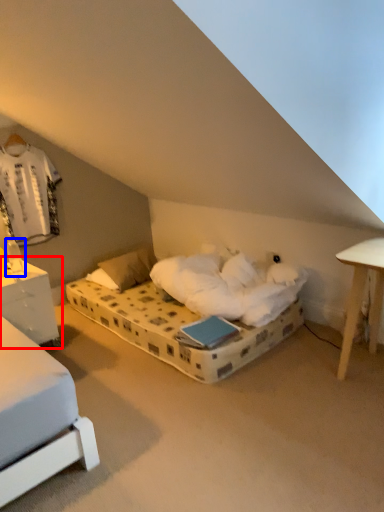
Question: Which object is closer to the camera taking this photo, nightstand (highlighted by a red box) or table lamp (highlighted by a blue box)?

Choices:
 (A) nightstand
 (B) table lamp

Answer: (A)